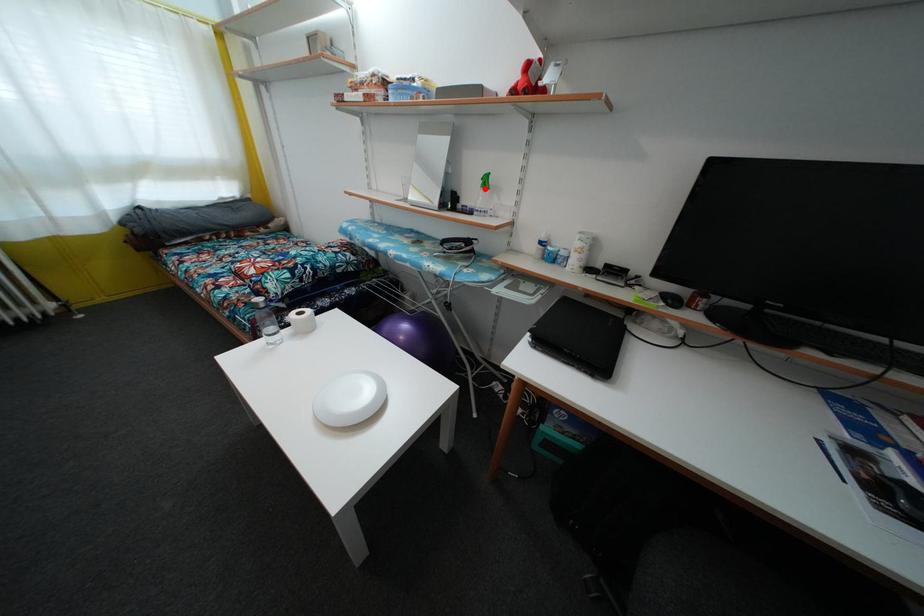
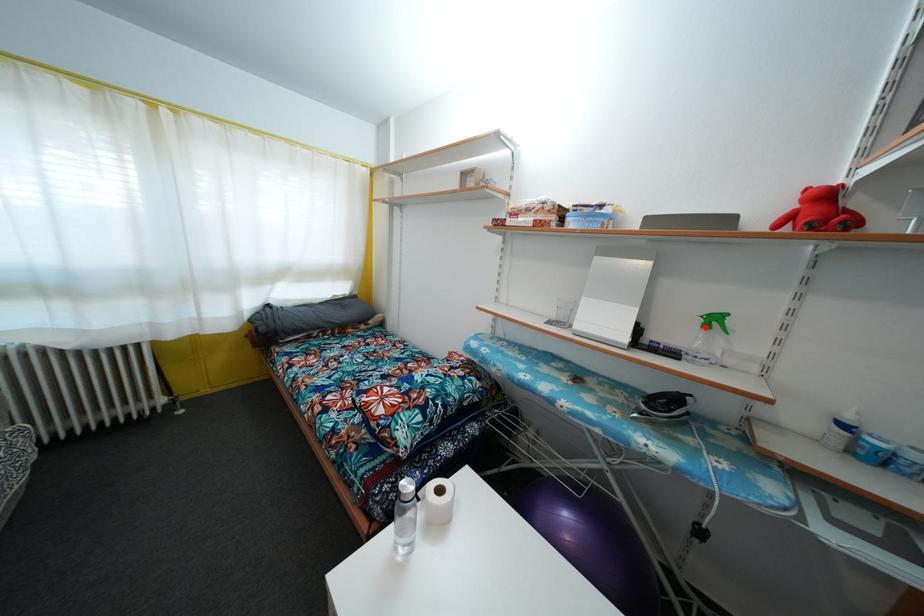
I am providing you with two images of the same scene from different viewpoints. A red point is marked on the first image and another point is marked on the second image. Does the point marked in image1 correspond to the same location as the one in image2?

Yes